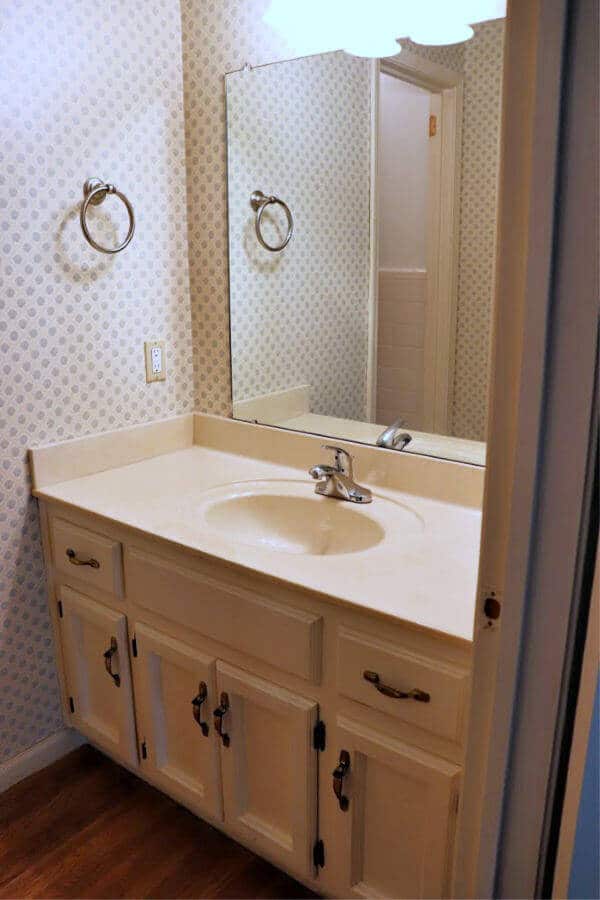
What are the coordinates of `brown hinges` in the screenshot? It's located at (318, 736).